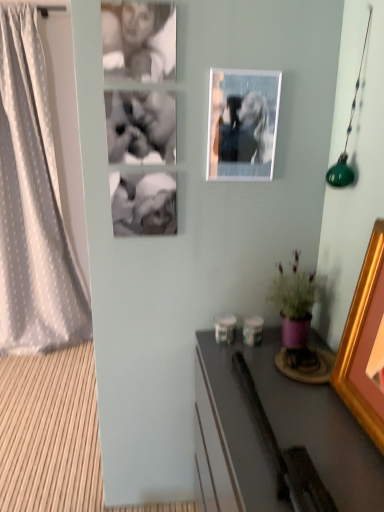
Question: Considering the relative sizes of purple matte pot at lower right and gold wooden picture frame at right, which is counted as the first picture frame, starting from the front, in the image provided, is purple matte pot at lower right smaller than gold wooden picture frame at right, which is counted as the first picture frame, starting from the front,?

Choices:
 (A) no
 (B) yes

Answer: (B)

Question: Can you confirm if purple matte pot at lower right is wider than gold wooden picture frame at right, marked as the second picture frame in a left-to-right arrangement?

Choices:
 (A) no
 (B) yes

Answer: (B)

Question: Is purple matte pot at lower right bigger than gold wooden picture frame at right, marked as the 1th picture frame in a right-to-left arrangement?

Choices:
 (A) no
 (B) yes

Answer: (A)

Question: Is purple matte pot at lower right oriented away from gold wooden picture frame at right, marked as the 2th picture frame in a back-to-front arrangement?

Choices:
 (A) yes
 (B) no

Answer: (B)

Question: Is purple matte pot at lower right outside gold wooden picture frame at right, marked as the second picture frame in a left-to-right arrangement?

Choices:
 (A) no
 (B) yes

Answer: (B)

Question: In the image, is purple matte pot at lower right positioned in front of or behind smooth gray desk at lower right?

Choices:
 (A) front
 (B) behind

Answer: (B)

Question: Is purple matte pot at lower right wider or thinner than smooth gray desk at lower right?

Choices:
 (A) thin
 (B) wide

Answer: (A)

Question: Is purple matte pot at lower right to the left or to the right of smooth gray desk at lower right in the image?

Choices:
 (A) left
 (B) right

Answer: (B)

Question: From a real-world perspective, is purple matte pot at lower right positioned above or below smooth gray desk at lower right?

Choices:
 (A) above
 (B) below

Answer: (A)

Question: Considering the positions of purple matte pot at lower right and gold wooden picture frame at right, marked as the 2th picture frame in a back-to-front arrangement, in the image, is purple matte pot at lower right wider or thinner than gold wooden picture frame at right, marked as the 2th picture frame in a back-to-front arrangement,?

Choices:
 (A) thin
 (B) wide

Answer: (B)

Question: Considering the relative positions of purple matte pot at lower right and gold wooden picture frame at right, marked as the 1th picture frame in a right-to-left arrangement, in the image provided, is purple matte pot at lower right to the left or to the right of gold wooden picture frame at right, marked as the 1th picture frame in a right-to-left arrangement,?

Choices:
 (A) right
 (B) left

Answer: (B)

Question: Is point (314, 301) closer or farther from the camera than point (382, 308)?

Choices:
 (A) closer
 (B) farther

Answer: (B)

Question: Relative to gold wooden picture frame at right, the second picture frame in the top-to-bottom sequence, is purple matte pot at lower right in front or behind?

Choices:
 (A) front
 (B) behind

Answer: (B)

Question: Considering the relative positions of white dotted fabric curtain at left and gold wooden picture frame at right, acting as the first picture frame starting from the bottom, in the image provided, is white dotted fabric curtain at left to the left or to the right of gold wooden picture frame at right, acting as the first picture frame starting from the bottom,?

Choices:
 (A) right
 (B) left

Answer: (B)

Question: From the image's perspective, is white dotted fabric curtain at left above or below gold wooden picture frame at right, acting as the first picture frame starting from the bottom?

Choices:
 (A) above
 (B) below

Answer: (A)